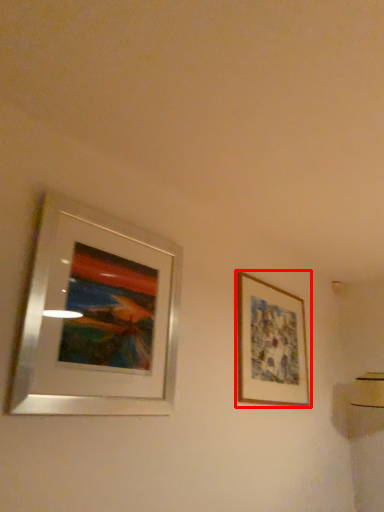
Question: From the image's perspective, considering the relative positions of picture frame (annotated by the red box) and picture frame in the image provided, where is picture frame (annotated by the red box) located with respect to the staircase?

Choices:
 (A) above
 (B) below

Answer: (B)